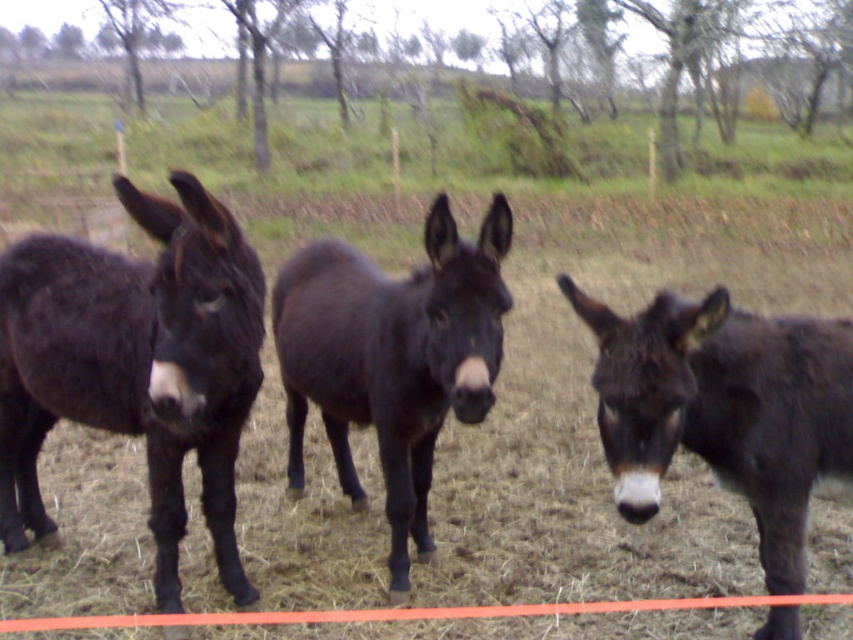
You are a photographer trying to capture a clear shot of both the dark brown fur mule at center and the shiny dark brown mule at center. Since you want to focus on the one closer to you, which mule should you aim your camera at?

The dark brown fur mule at center is closer to the viewer than the shiny dark brown mule at center, so you should aim your camera at the dark brown fur mule at center to focus on the one closer to you.

You are a farmer who wants to load a heavy sack onto a mule. You have two options in the image, the shiny black mule at left and the shiny dark brown mule at center. Which mule should you choose if you want the one that is taller?

The shiny black mule at left is taller than the shiny dark brown mule at center, so you should choose the shiny black mule at left.